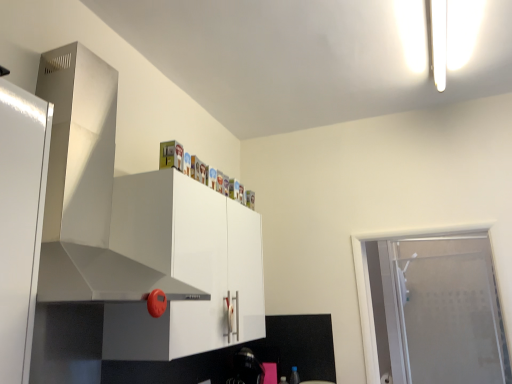
Where is `stainless steel exhaust hood at upper left`? stainless steel exhaust hood at upper left is located at coordinates (98, 194).

Find the location of a particular element. This screenshot has width=512, height=384. white glossy cabinet at upper center is located at coordinates (184, 267).

The width and height of the screenshot is (512, 384). What are the coordinates of `stainless steel exhaust hood at upper left` in the screenshot? It's located at (98, 194).

Between stainless steel exhaust hood at upper left and white glossy cabinet at upper center, which one has more height?

Standing taller between the two is stainless steel exhaust hood at upper left.

Who is smaller, stainless steel exhaust hood at upper left or white glossy cabinet at upper center?

white glossy cabinet at upper center.

Does point (69, 167) come farther from viewer compared to point (127, 195)?

No.

Looking at their sizes, would you say stainless steel exhaust hood at upper left is wider or thinner than white glossy cabinet at upper center?

Considering their sizes, stainless steel exhaust hood at upper left looks broader than white glossy cabinet at upper center.

How far apart are white glossy cabinet at upper center and stainless steel exhaust hood at upper left?

The distance of white glossy cabinet at upper center from stainless steel exhaust hood at upper left is 12.59 inches.

From the picture: Is white glossy cabinet at upper center far from stainless steel exhaust hood at upper left?

That's not correct — white glossy cabinet at upper center is a little close to stainless steel exhaust hood at upper left.

From the image's perspective, between white glossy cabinet at upper center and stainless steel exhaust hood at upper left, which one is located above?

stainless steel exhaust hood at upper left appears higher in the image.

Is white glossy cabinet at upper center positioned with its back to stainless steel exhaust hood at upper left?

No, white glossy cabinet at upper center is not facing the opposite direction of stainless steel exhaust hood at upper left.

Is white glossy cabinet at upper center not near frosted glass door at right?

Yes, white glossy cabinet at upper center and frosted glass door at right are located far from each other.

Who is smaller, white glossy cabinet at upper center or frosted glass door at right?

Smaller between the two is frosted glass door at right.

From the image's perspective, is white glossy cabinet at upper center positioned above or below frosted glass door at right?

white glossy cabinet at upper center is above frosted glass door at right.

Considering the points (231, 300) and (462, 372), which point is behind, point (231, 300) or point (462, 372)?

Positioned behind is point (462, 372).

Is stainless steel exhaust hood at upper left to the left or to the right of frosted glass door at right in the image?

Based on their positions, stainless steel exhaust hood at upper left is located to the left of frosted glass door at right.

Is stainless steel exhaust hood at upper left not near frosted glass door at right?

stainless steel exhaust hood at upper left is far away from frosted glass door at right.

From a real-world perspective, who is located lower, stainless steel exhaust hood at upper left or frosted glass door at right?

frosted glass door at right is physically lower.

Is the position of frosted glass door at right more distant than that of white glossy cabinet at upper center?

Yes, it is behind white glossy cabinet at upper center.

Would you consider frosted glass door at right to be distant from white glossy cabinet at upper center?

Yes, frosted glass door at right and white glossy cabinet at upper center are quite far apart.

Considering the points (437, 361) and (136, 224), which point is in front, point (437, 361) or point (136, 224)?

The point (136, 224) is closer to the camera.

Is frosted glass door at right wider or thinner than white glossy cabinet at upper center?

Considering their sizes, frosted glass door at right looks slimmer than white glossy cabinet at upper center.

Is the surface of frosted glass door at right in direct contact with stainless steel exhaust hood at upper left?

No, frosted glass door at right is not with stainless steel exhaust hood at upper left.

Does frosted glass door at right come in front of stainless steel exhaust hood at upper left?

No, frosted glass door at right is further to the viewer.

In the scene shown: Between frosted glass door at right and stainless steel exhaust hood at upper left, which one has smaller size?

With smaller size is frosted glass door at right.

What are the coordinates of `exhaust hood lying in front of the white glossy cabinet at upper center` in the screenshot? It's located at (98, 194).

Find the location of `cabinetry lying on the right of stainless steel exhaust hood at upper left`. cabinetry lying on the right of stainless steel exhaust hood at upper left is located at coordinates (184, 267).

Estimate the real-world distances between objects in this image. Which object is further from frosted glass door at right, white glossy cabinet at upper center or stainless steel exhaust hood at upper left?

stainless steel exhaust hood at upper left is further to frosted glass door at right.

Estimate the real-world distances between objects in this image. Which object is further from stainless steel exhaust hood at upper left, white glossy cabinet at upper center or frosted glass door at right?

frosted glass door at right is positioned further to the anchor stainless steel exhaust hood at upper left.

Based on their spatial positions, is stainless steel exhaust hood at upper left or white glossy cabinet at upper center further from frosted glass door at right?

stainless steel exhaust hood at upper left is positioned further to the anchor frosted glass door at right.

Estimate the real-world distances between objects in this image. Which object is further from stainless steel exhaust hood at upper left, frosted glass door at right or white glossy cabinet at upper center?

Based on the image, frosted glass door at right appears to be further to stainless steel exhaust hood at upper left.

From the image, which object appears to be nearer to white glossy cabinet at upper center, stainless steel exhaust hood at upper left or frosted glass door at right?

The object closer to white glossy cabinet at upper center is stainless steel exhaust hood at upper left.

Which object lies nearer to the anchor point white glossy cabinet at upper center, frosted glass door at right or stainless steel exhaust hood at upper left?

stainless steel exhaust hood at upper left is positioned closer to the anchor white glossy cabinet at upper center.

This screenshot has width=512, height=384. I want to click on cabinetry between stainless steel exhaust hood at upper left and frosted glass door at right from left to right, so click(184, 267).